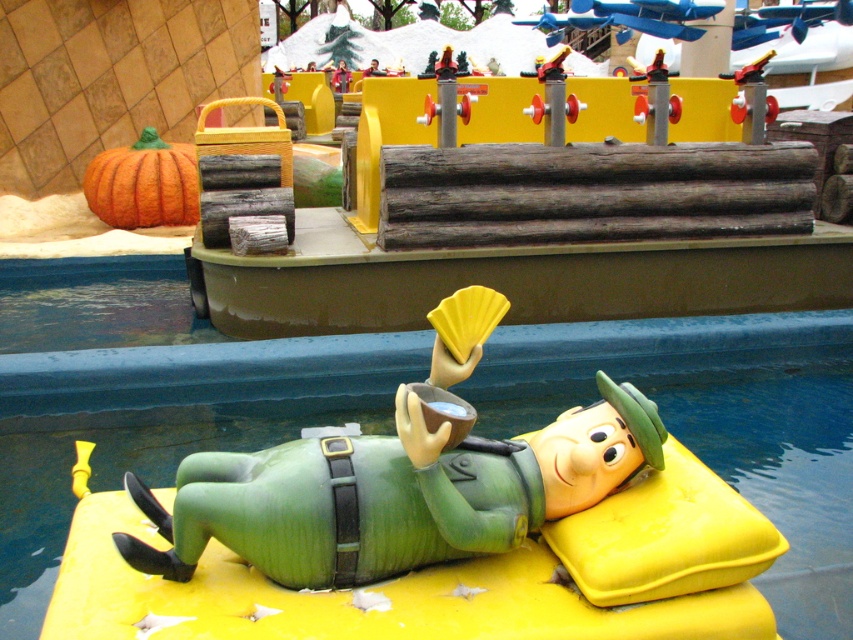
Question: Among these points, which one is nearest to the camera?

Choices:
 (A) (718, 385)
 (B) (154, 193)
 (C) (448, 524)

Answer: (C)

Question: Which point is closer to the camera?

Choices:
 (A) (109, 148)
 (B) (508, 445)
 (C) (485, 355)

Answer: (B)

Question: Estimate the real-world distances between objects in this image. Which object is farther from the blue smooth water at lower center?

Choices:
 (A) orange matte pumpkin at upper left
 (B) smooth green figure at center

Answer: (A)

Question: Is blue smooth water at lower center smaller than smooth green figure at center?

Choices:
 (A) yes
 (B) no

Answer: (B)

Question: Can you confirm if blue smooth water at lower center is bigger than orange matte pumpkin at upper left?

Choices:
 (A) yes
 (B) no

Answer: (B)

Question: Considering the relative positions of smooth green figure at center and orange matte pumpkin at upper left in the image provided, where is smooth green figure at center located with respect to orange matte pumpkin at upper left?

Choices:
 (A) left
 (B) right

Answer: (B)